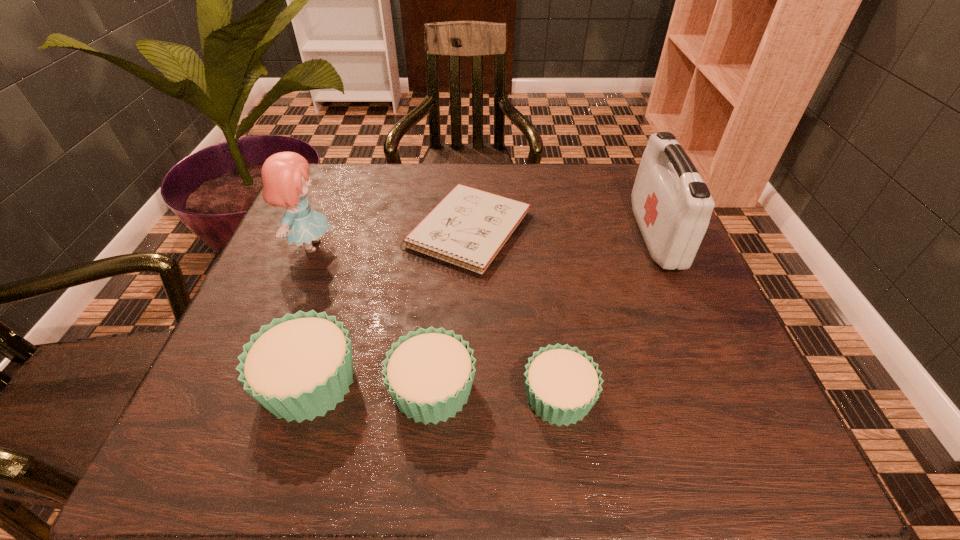
Where is `the leftmost cupcake`? The height and width of the screenshot is (540, 960). the leftmost cupcake is located at coordinates (299, 366).

Find the location of a particular element. The width and height of the screenshot is (960, 540). the second cupcake from right to left is located at coordinates (429, 373).

Where is `the second tallest cupcake`? the second tallest cupcake is located at coordinates (429, 373).

Where is `the rightmost cupcake`? This screenshot has width=960, height=540. the rightmost cupcake is located at coordinates (562, 383).

Where is `the second shortest object`? This screenshot has width=960, height=540. the second shortest object is located at coordinates (562, 383).

Identify the location of notepad. (468, 228).

Find the location of a particular element. the first-aid kit is located at coordinates (672, 205).

You are a GUI agent. You are given a task and a screenshot of the screen. Output one action in this format:
    pyautogui.click(x=<x>, y=<y>)
    Task: Click on the doll
    This screenshot has height=540, width=960.
    Given the screenshot: What is the action you would take?
    pyautogui.click(x=285, y=175)

I want to click on vacant space located on the back of the leftmost cupcake, so click(348, 258).

Identify the location of blank area located on the back of the second tallest cupcake. This screenshot has width=960, height=540. (441, 296).